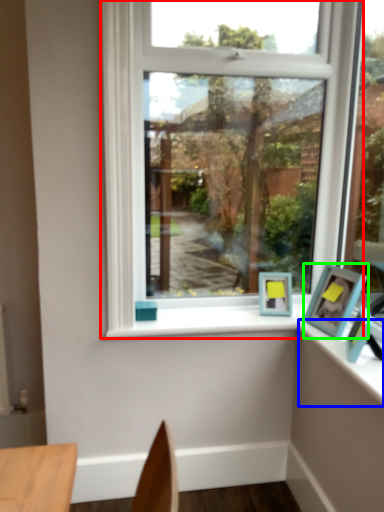
Question: Which is farther away from window (highlighted by a red box)? counter top (highlighted by a blue box) or picture frame (highlighted by a green box)?

Choices:
 (A) counter top
 (B) picture frame

Answer: (A)